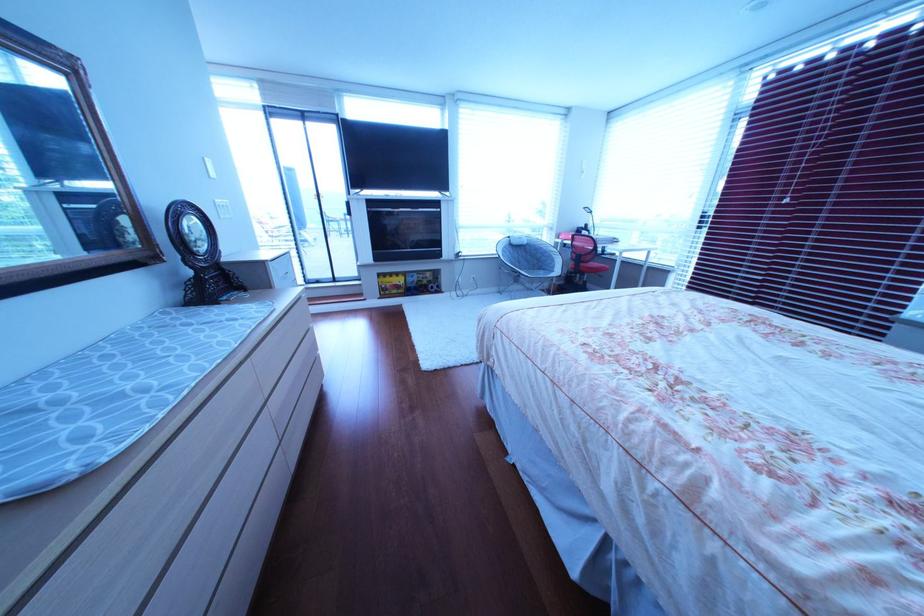
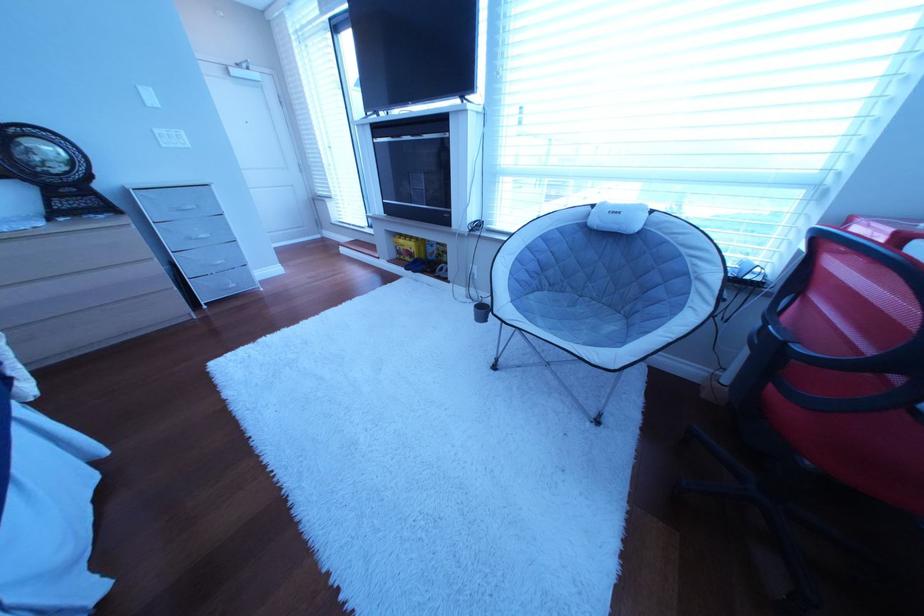
Find the pixel in the second image that matches point 405,286 in the first image.

(418, 251)